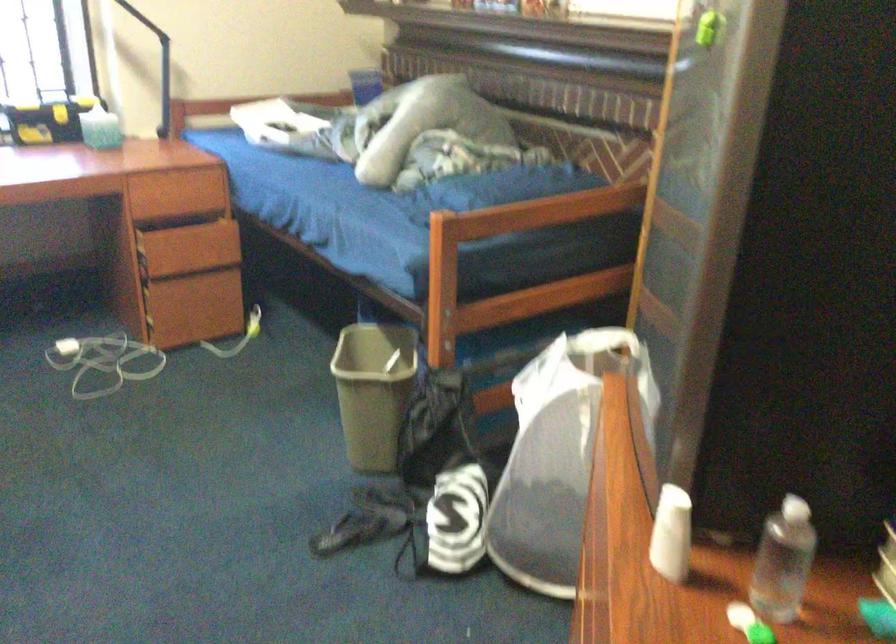
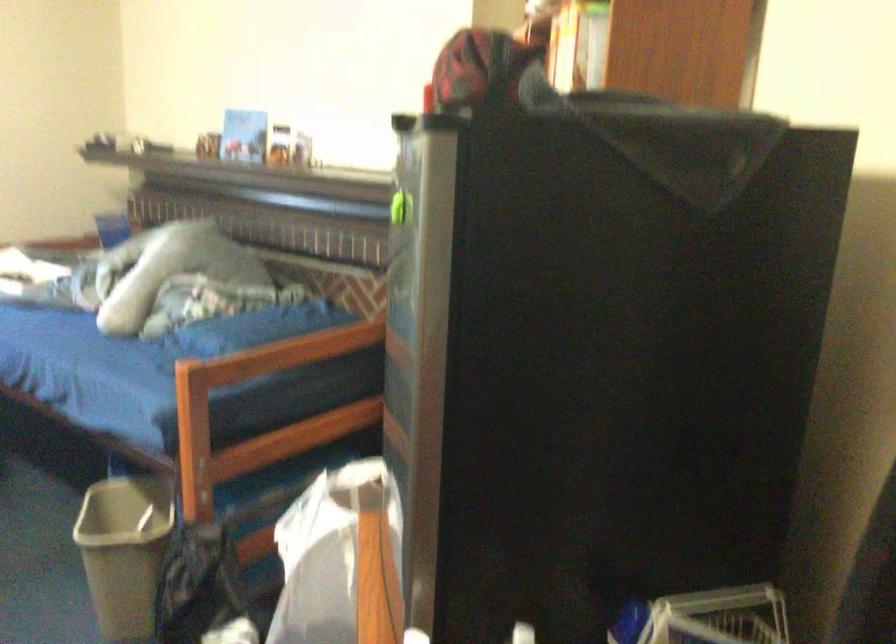
Find the pixel in the second image that matches (374,386) in the first image.

(124, 552)